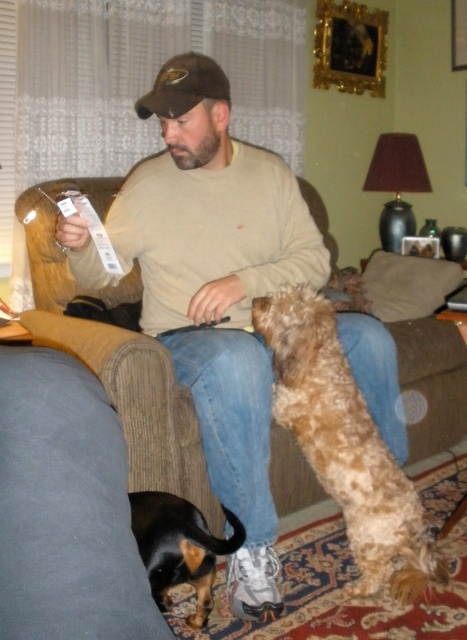
You are a dog trainer who needs to place a divider between the two dogs to prevent them from fighting. The divider you have is 1.1 meters wide. Based on the scene, will the divider fit between the black leather dog at lower left and the fuzzy brown dog at center?

The distance between the black leather dog at lower left and the fuzzy brown dog at center is 1.20 meters. Since the divider is 1.1 meters wide, there will be enough space to place it between them as 1.20 meters is greater than 1.1 meters. The divider will fit with some space remaining on either side.

You are a delivery robot that needs to deliver a package to the man in the brown armchair. The package is 1.5 meters in length. Can you place the package on the beige sweater at center without it hanging off the edge?

The beige sweater at center is 1.44 meters away from the camera. Since the package is 1.5 meters long, it will hang off the edge if placed there.

You are a photographer trying to capture a closeup of the small, light brown dog with a fluffy coat standing on its hind legs. You have two focus points available at coordinates point [213,387] and point [168,102]. Which focus point should you choose to ensure the dog is in focus?

Point [213,387] is closer to the camera than point [168,102], so you should choose point [213,387] to ensure the small, light brown dog with a fluffy coat standing on its hind legs is in focus.